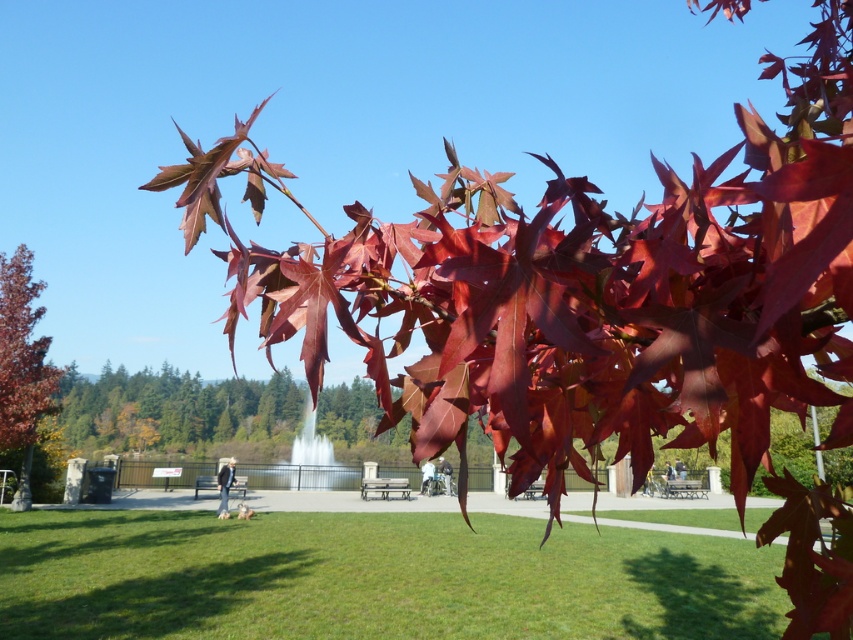
Question: Does shiny red maple leaf at center have a smaller size compared to wooden park bench at center?

Choices:
 (A) yes
 (B) no

Answer: (A)

Question: Estimate the real-world distances between objects in this image. Which object is farther from the white glossy fountain at center?

Choices:
 (A) smooth reddish-brown tree at left
 (B) shiny red maple leaf at upper center
 (C) wooden park bench at center
 (D) metallic silver bench at center

Answer: (B)

Question: Is glossy red maple leaves at center to the left of shiny red maple leaf at upper center from the viewer's perspective?

Choices:
 (A) no
 (B) yes

Answer: (B)

Question: Which point is farther to the camera?

Choices:
 (A) (207, 179)
 (B) (277, 316)
 (C) (283, 456)

Answer: (C)

Question: Can you confirm if shiny red maple leaf at upper center is smaller than white glossy fountain at center?

Choices:
 (A) no
 (B) yes

Answer: (B)

Question: Which object is positioned farthest from the metallic silver bench at center?

Choices:
 (A) glossy red maple leaves at center
 (B) wooden park bench at center

Answer: (A)